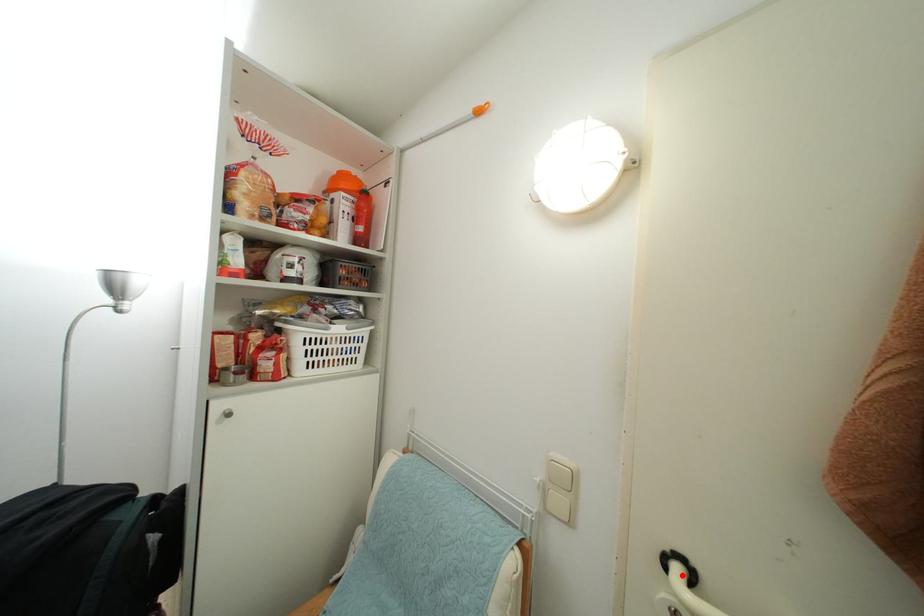
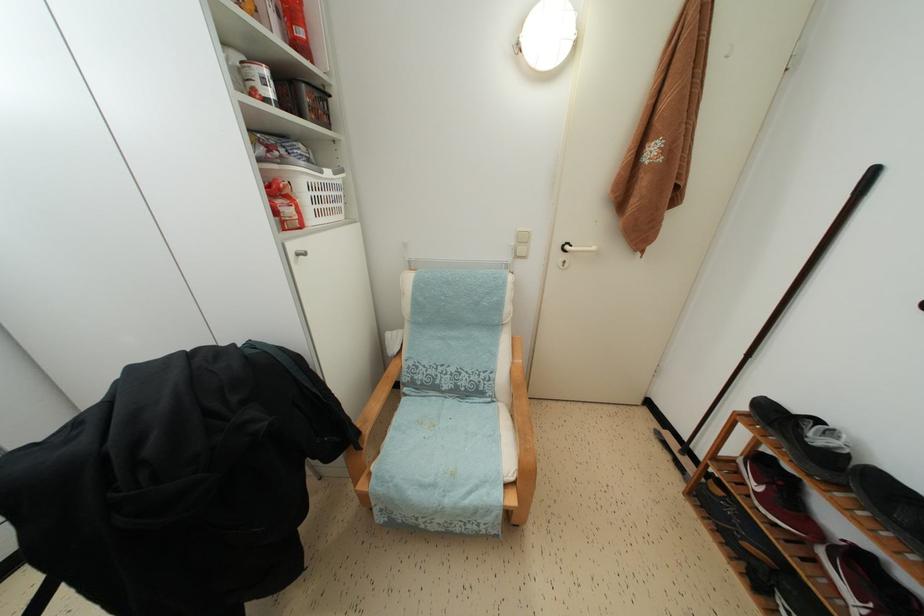
The point at the highlighted location is marked in the first image. Where is the corresponding point in the second image?

(572, 253)